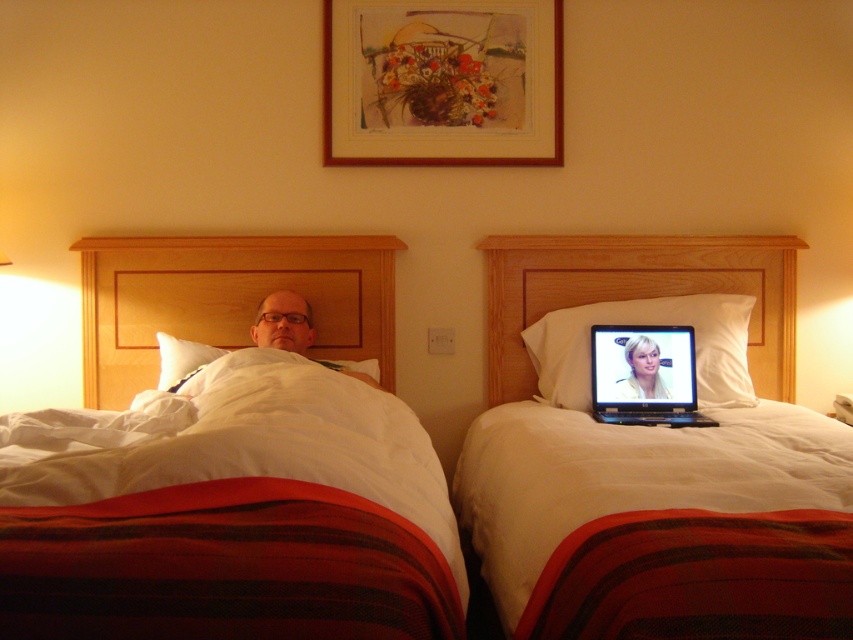
Can you confirm if white soft pillow at upper right is positioned above matte black man at center?

Actually, white soft pillow at upper right is below matte black man at center.

At what (x,y) coordinates should I click in order to perform the action: click on white soft pillow at upper right. Please return your answer as a coordinate pair (x, y). The height and width of the screenshot is (640, 853). Looking at the image, I should click on (646, 323).

Does wooden headboard at upper center appear on the left side of white soft pillow at center?

Incorrect, wooden headboard at upper center is not on the left side of white soft pillow at center.

Between wooden headboard at upper center and white soft pillow at center, which one is positioned higher?

wooden headboard at upper center

Does point (112, 340) lie behind point (184, 360)?

Yes.

Locate an element on the screen. wooden headboard at upper center is located at coordinates (225, 300).

Who is higher up, striped cotton bed at center or wooden picture frame at upper center?

wooden picture frame at upper center is above.

Does striped cotton bed at center appear under wooden picture frame at upper center?

Correct, striped cotton bed at center is located below wooden picture frame at upper center.

Find the location of `striped cotton bed at center`. striped cotton bed at center is located at coordinates (239, 518).

Identify the location of striped cotton bed at center. This screenshot has height=640, width=853. (239, 518).